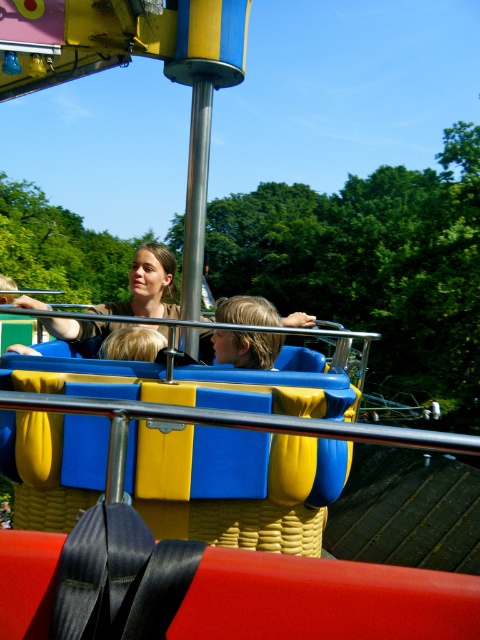
Does matte brown shirt at center have a greater width compared to blonde hair at center?

Correct, the width of matte brown shirt at center exceeds that of blonde hair at center.

Can you confirm if matte brown shirt at center is positioned below blonde hair at center?

No, matte brown shirt at center is not below blonde hair at center.

Is point (163, 257) more distant than point (220, 333)?

That is True.

Locate an element on the screen. This screenshot has height=640, width=480. matte brown shirt at center is located at coordinates (147, 284).